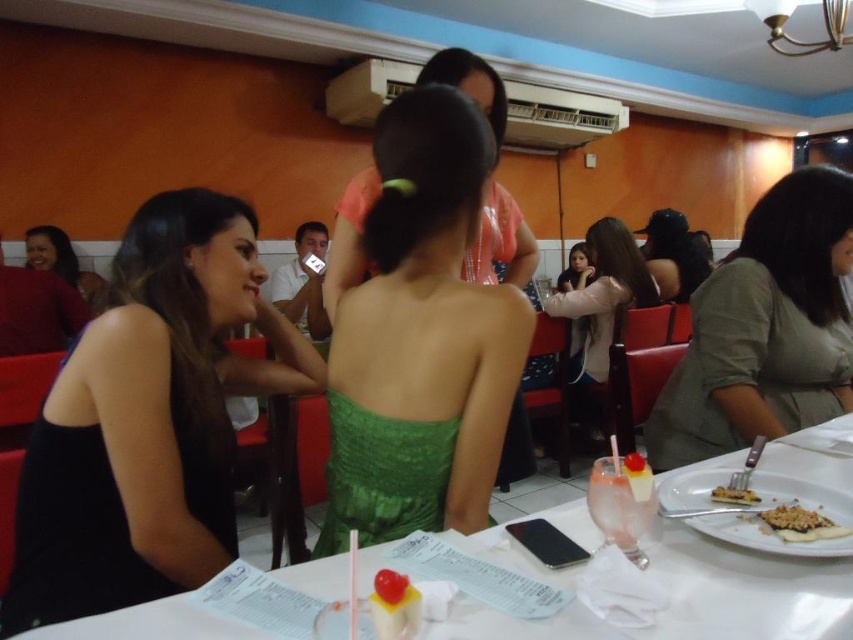
You are a server carrying a dessert tray that needs to place a crumbly brown cake at lower right onto the white paper table at center. The tray is 10 inches wide. Can you safely move the tray from the cake to the table without tilting it sideways?

The distance between the white paper table at center and the crumbly brown cake at lower right is 12.04 inches. Since the tray is 10 inches wide, there is enough space to move it safely without tilting sideways.

You are a customer at the restaurant and want to choose between the black matte dress at left and the light pink fabric jacket at center to wear for an event. Based on their sizes, which one might be more suitable for someone who prefers a more fitted or slimming look?

The black matte dress at left has a lesser width compared to the light pink fabric jacket at center, so it might be more suitable for someone who prefers a more fitted or slimming look.